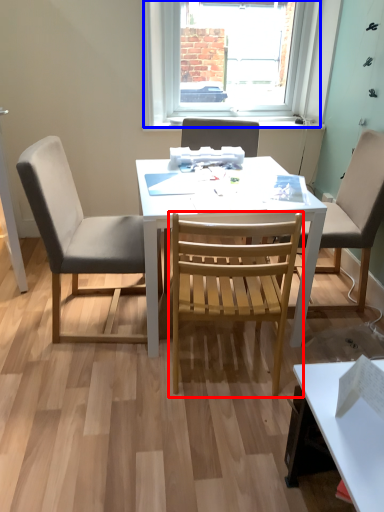
Question: Which point is further to the camera, chair (highlighted by a red box) or window (highlighted by a blue box)?

Choices:
 (A) chair
 (B) window

Answer: (B)